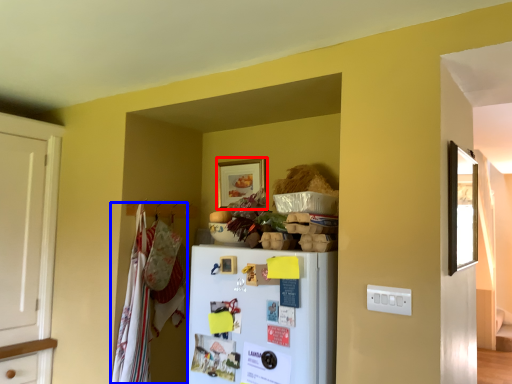
Question: Which of the following is the farthest to the observer, picture frame (highlighted by a red box) or laundry (highlighted by a blue box)?

Choices:
 (A) picture frame
 (B) laundry

Answer: (A)